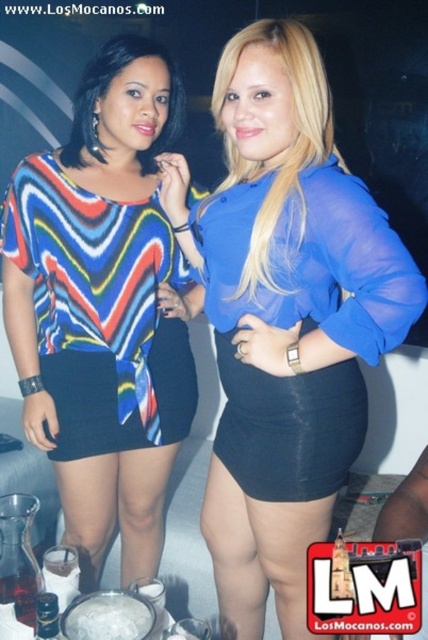
Question: Which object is positioned farthest from the shiny metallic bottle at lower left?

Choices:
 (A) multicolored fabric dress at center
 (B) blue sheer blouse at center
 (C) multicolored printed blouse at left

Answer: (A)

Question: Where is blue sheer blouse at center located in relation to shiny metallic bottle at lower left in the image?

Choices:
 (A) above
 (B) below

Answer: (A)

Question: Considering the real-world distances, which object is farthest from the multicolored fabric dress at center?

Choices:
 (A) shiny metallic bottle at lower left
 (B) multicolored printed blouse at left

Answer: (A)

Question: Which point appears closest to the camera in this image?

Choices:
 (A) (74, 244)
 (B) (178, 93)
 (C) (323, 448)

Answer: (C)

Question: Does blue sheer blouse at center appear under shiny metallic bottle at lower left?

Choices:
 (A) no
 (B) yes

Answer: (A)

Question: Can you confirm if blue sheer blouse at center is positioned to the left of shiny metallic bottle at lower left?

Choices:
 (A) yes
 (B) no

Answer: (B)